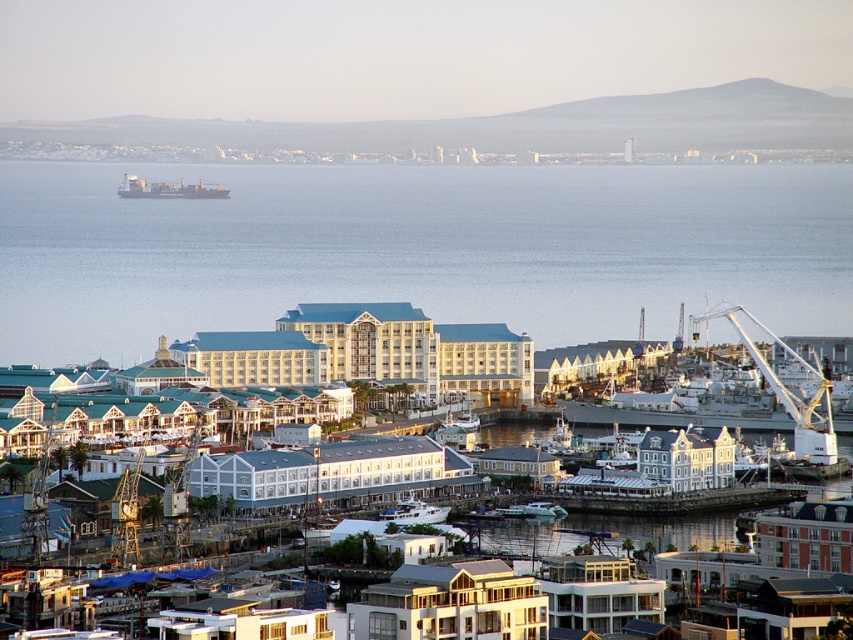
You are a port authority official assessing the dimensions of vessels and equipment in the scene. The white metallic crane at right and the matte gray cargo ship at upper left are both in view. Which one has a greater width?

The white metallic crane at right has a greater width than the matte gray cargo ship at upper left according to the description.

In the scene shown: You are a tourist standing in the waterfront scene and want to take a photo of both the white glossy building at center and the white glass building at center. Since you want to include both in the frame, which building should you focus on first to ensure both are visible?

The white glossy building at center is located below the white glass building at center, so you should focus on the white glass building at center first to ensure both are visible in the frame.